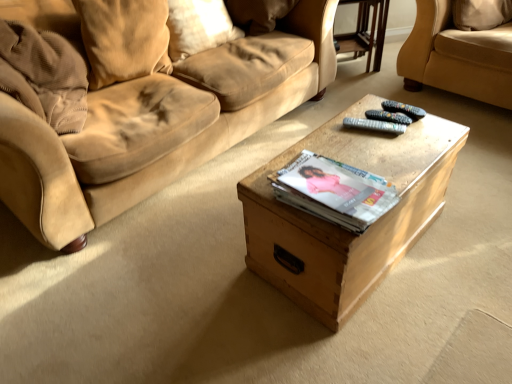
Where is `free space in front of black plastic remote at center, which appears as the second remote when ordered from the bottom`? The image size is (512, 384). free space in front of black plastic remote at center, which appears as the second remote when ordered from the bottom is located at coordinates [x=417, y=136].